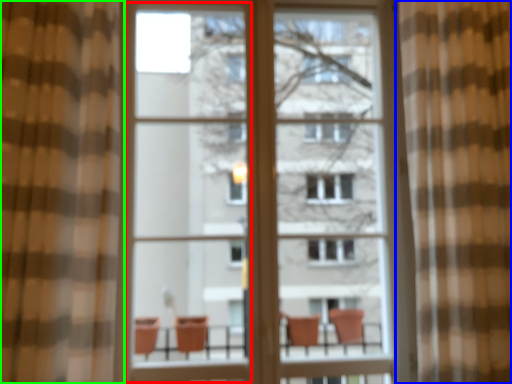
Question: Estimate the real-world distances between objects in this image. Which object is closer to screen door (highlighted by a red box), curtain (highlighted by a blue box) or curtain (highlighted by a green box)?

Choices:
 (A) curtain
 (B) curtain

Answer: (B)